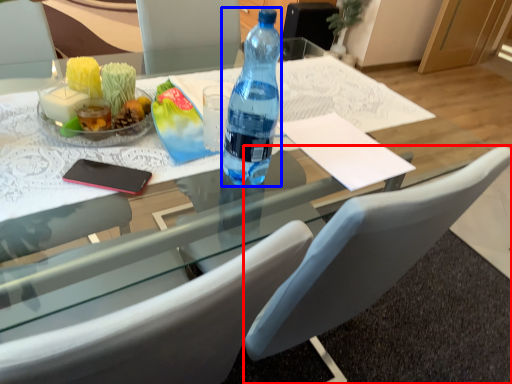
Question: Which object appears closest to the camera in this image, chair (highlighted by a red box) or bottle (highlighted by a blue box)?

Choices:
 (A) chair
 (B) bottle

Answer: (A)